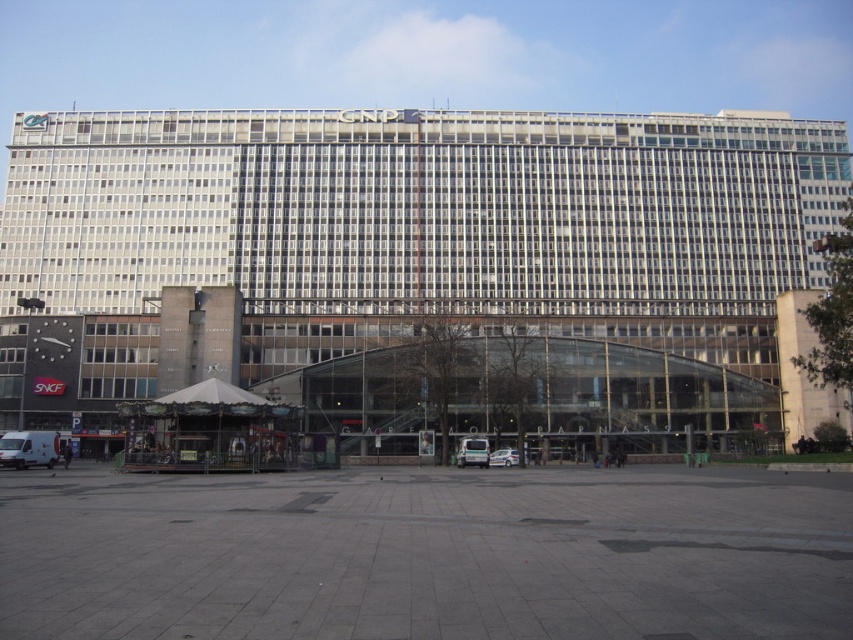
Which is more to the left, white glossy car at center or metallic silver car at center?

white glossy car at center is more to the left.

Does point (469, 449) lie in front of point (515, 449)?

Yes, point (469, 449) is closer to viewer.

The height and width of the screenshot is (640, 853). I want to click on white glossy car at center, so click(x=473, y=452).

Between gray concrete plaza at center and white glossy car at center, which one has less height?

white glossy car at center is shorter.

Does point (55, 186) come behind point (477, 442)?

That is True.

The width and height of the screenshot is (853, 640). In order to click on gray concrete plaza at center in this screenshot , I will do `click(424, 225)`.

Who is shorter, white matte van at lower left or white glossy car at center?

white glossy car at center

Is point (44, 451) behind point (474, 454)?

No, it is in front of (474, 454).

The height and width of the screenshot is (640, 853). Find the location of `white matte van at lower left`. white matte van at lower left is located at coordinates (28, 449).

Image resolution: width=853 pixels, height=640 pixels. In order to click on white matte van at lower left in this screenshot , I will do `click(28, 449)`.